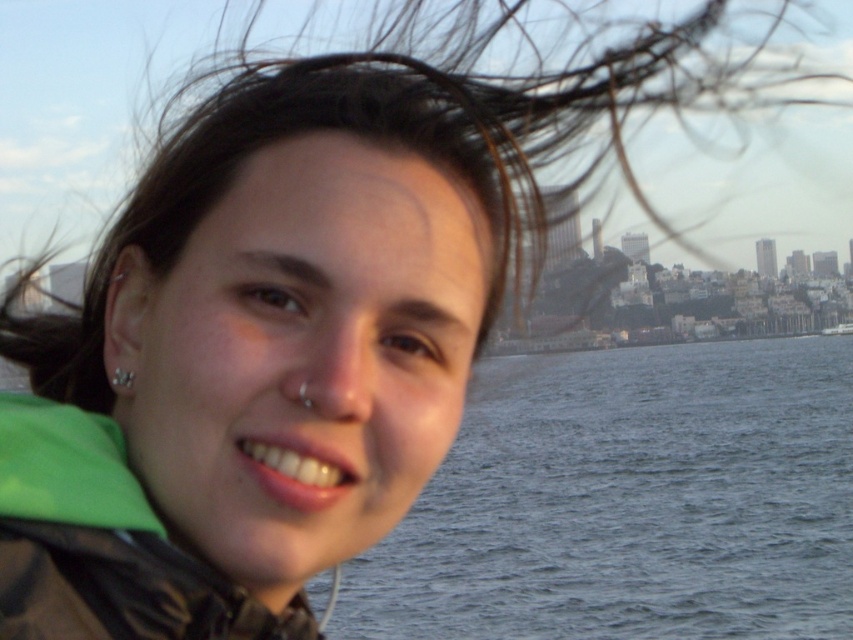
Question: Does blue water at center appear over green fabric jacket at lower left?

Choices:
 (A) no
 (B) yes

Answer: (A)

Question: Where is blue water at center located in relation to green fabric jacket at lower left in the image?

Choices:
 (A) left
 (B) right

Answer: (B)

Question: Where is blue water at center located in relation to green fabric jacket at lower left in the image?

Choices:
 (A) above
 (B) below

Answer: (B)

Question: Which point appears farthest from the camera in this image?

Choices:
 (A) (209, 630)
 (B) (798, 356)

Answer: (B)